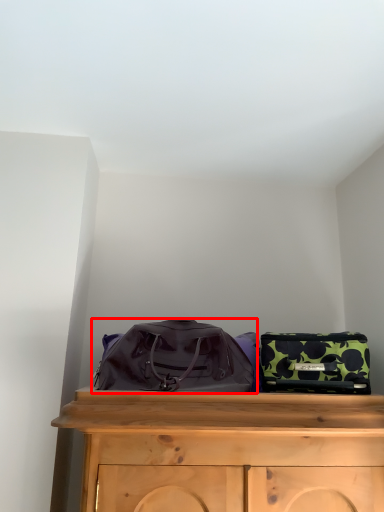
Question: From the image's perspective, where is luggage and bags (annotated by the red box) located in relation to luggage and bags in the image?

Choices:
 (A) below
 (B) above

Answer: (B)